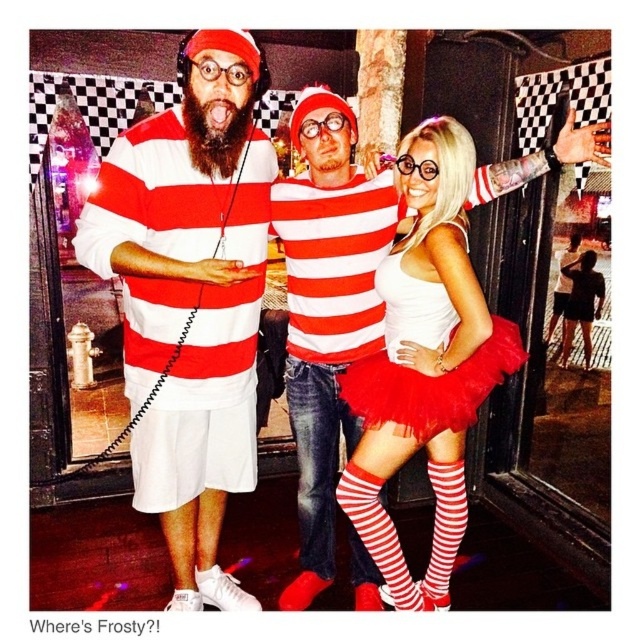
You are a photographer setting up for a group photo. You need to decide where to place the two center individuals so that their skirts won not overlap. Given that the white tulle skirt at center and the red tulle skirt at center are both at the center, which skirt should be positioned further back to prevent overlapping?

The white tulle skirt at center should be positioned further back since it is wider than the red tulle skirt at center, allowing more space between them and preventing overlap.

You are a costume designer trying to decide which item to place on a mannequin. The matte white shorts at center and the red tulle skirt at center are both part of the costume. Which item has a narrower width?

The matte white shorts at center has a narrower width than the red tulle skirt at center.

You are a costume designer trying to determine the spatial relationship between the matte white shorts at center and the white tulle skirt at center in the image. Which one is positioned higher up on the person?

The matte white shorts at center is taller than white tulle skirt at center, so the matte white shorts at center is positioned higher up on the person.